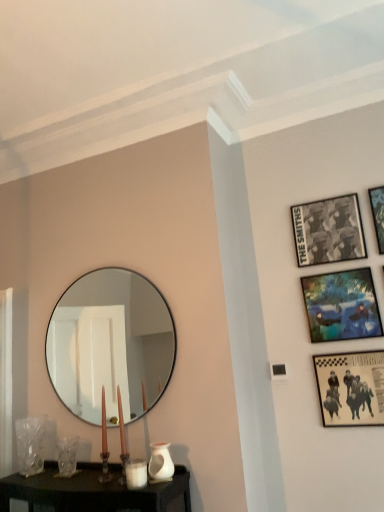
Question: From a real-world perspective, is metallic silver picture frame at upper right, the fourth picture frame ordered from the bottom, physically located above or below blue fabric painting at upper right, which is the 2th picture frame in bottom-to-top order?

Choices:
 (A) below
 (B) above

Answer: (B)

Question: Is metallic silver picture frame at upper right, which is the 1th picture frame from top to bottom, taller or shorter than blue fabric painting at upper right, positioned as the third picture frame in top-to-bottom order?

Choices:
 (A) tall
 (B) short

Answer: (A)

Question: Estimate the real-world distances between objects in this image. Which object is closer to the matte black picture frame at lower right, which is the first picture frame in bottom-to-top order?

Choices:
 (A) white glossy vase at lower center
 (B) clear glass vase at lower left
 (C) metallic silver picture frame at upper right, the fourth picture frame ordered from the bottom
 (D) white matte candle holder at lower center
 (E) blue fabric painting at upper right, which is the 2th picture frame in bottom-to-top order

Answer: (E)

Question: Estimate the real-world distances between objects in this image. Which object is farther from the matte black picture frame at lower right, which is the first picture frame in bottom-to-top order?

Choices:
 (A) white glossy vase at lower center
 (B) blue fabric painting at upper right, which is the 2th picture frame in bottom-to-top order
 (C) white matte candle holder at lower center
 (D) metallic silver picture frame at upper right, the fourth picture frame ordered from the bottom
 (E) black paper picture frame at upper right, positioned as the 2th picture frame in top-to-bottom order

Answer: (C)